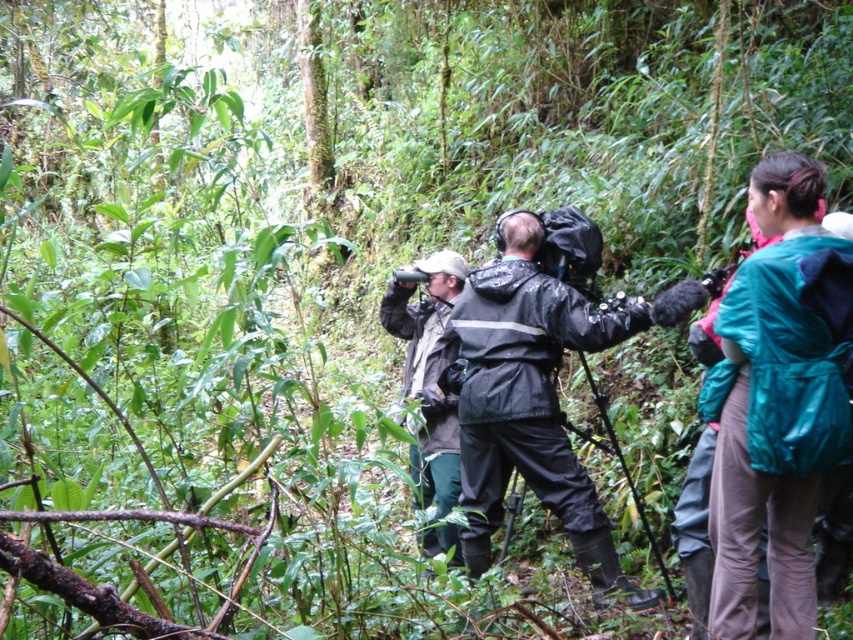
Does teal matte jacket at right appear under waterproof black jacket at center?

No.

Between teal matte jacket at right and waterproof black jacket at center, which one is positioned higher?

teal matte jacket at right is above.

Describe the element at coordinates (775, 406) in the screenshot. I see `teal matte jacket at right` at that location.

Where is `teal matte jacket at right`? This screenshot has height=640, width=853. teal matte jacket at right is located at coordinates (775, 406).